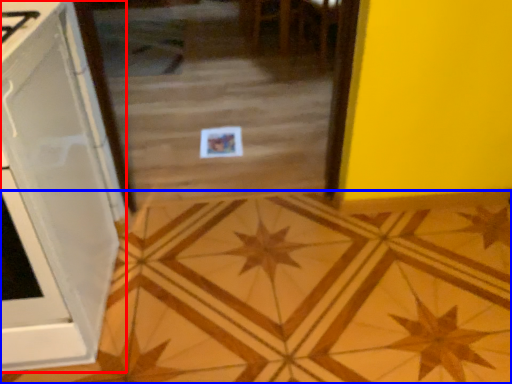
Question: Which of the following is the closest to the observer, cabinetry (highlighted by a red box) or ceramic tile (highlighted by a blue box)?

Choices:
 (A) cabinetry
 (B) ceramic tile

Answer: (A)